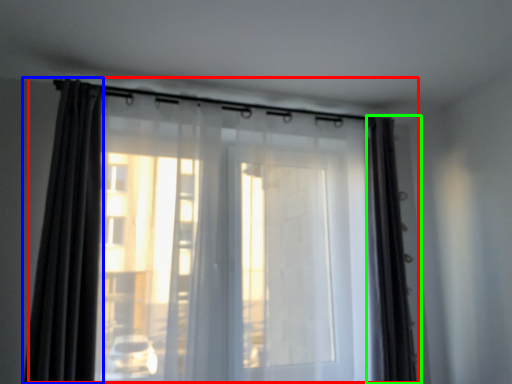
Question: Which object is positioned closest to curtain (highlighted by a red box)? Select from curtain (highlighted by a blue box) and curtain (highlighted by a green box).

Choices:
 (A) curtain
 (B) curtain

Answer: (A)